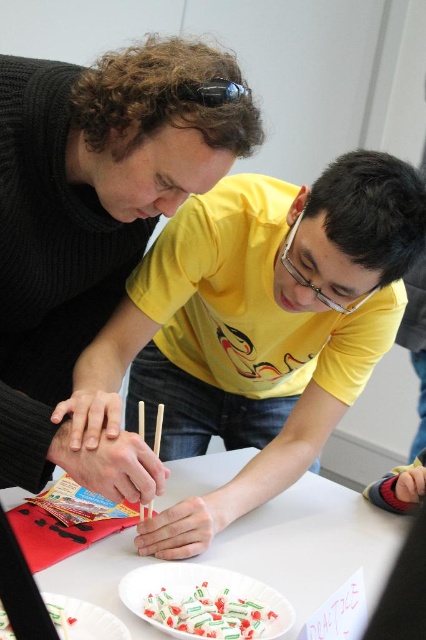
Who is more forward, (334, 509) or (215, 92)?

Point (215, 92) is more forward.

Describe the element at coordinates (310, 545) in the screenshot. I see `white paper plate at center` at that location.

Between point (256, 524) and point (192, 90), which one is positioned behind?

The point (256, 524) is more distant.

What are the coordinates of `white paper plate at center` in the screenshot? It's located at (310, 545).

Based on the photo, is white glossy candy at lower center positioned before white glossy plate at lower left?

No, white glossy candy at lower center is further to the viewer.

Is white glossy candy at lower center smaller than white glossy plate at lower left?

Yes, white glossy candy at lower center is smaller than white glossy plate at lower left.

Between point (173, 609) and point (126, 628), which one is positioned in front?

Point (126, 628) is more forward.

Image resolution: width=426 pixels, height=640 pixels. I want to click on white glossy candy at lower center, so click(209, 612).

Is black matte shirt at center taller than black rubber goggles at upper center?

Indeed, black matte shirt at center has a greater height compared to black rubber goggles at upper center.

Can you confirm if black matte shirt at center is thinner than black rubber goggles at upper center?

No, black matte shirt at center is not thinner than black rubber goggles at upper center.

Is point (183, 198) more distant than point (206, 90)?

That is True.

In order to click on black matte shirt at center in this screenshot , I will do `click(92, 225)`.